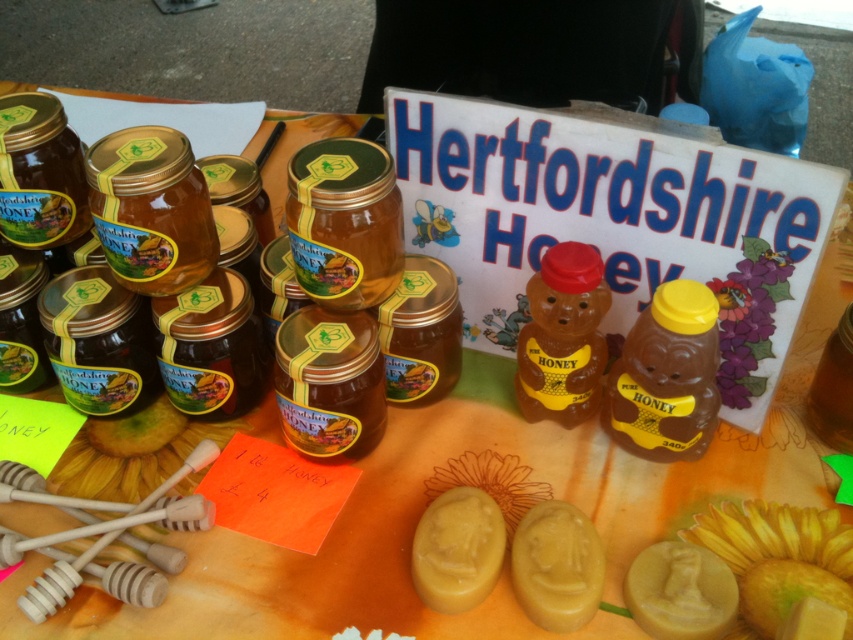
You are a customer at the market stall and want to buy both the yellow matte honeycomb at center and the yellow matte honey soap at center. The cashier asks you to point out their positions relative to each other. How would you describe their arrangement?

The yellow matte honeycomb at center is positioned above the yellow matte honey soap at center.